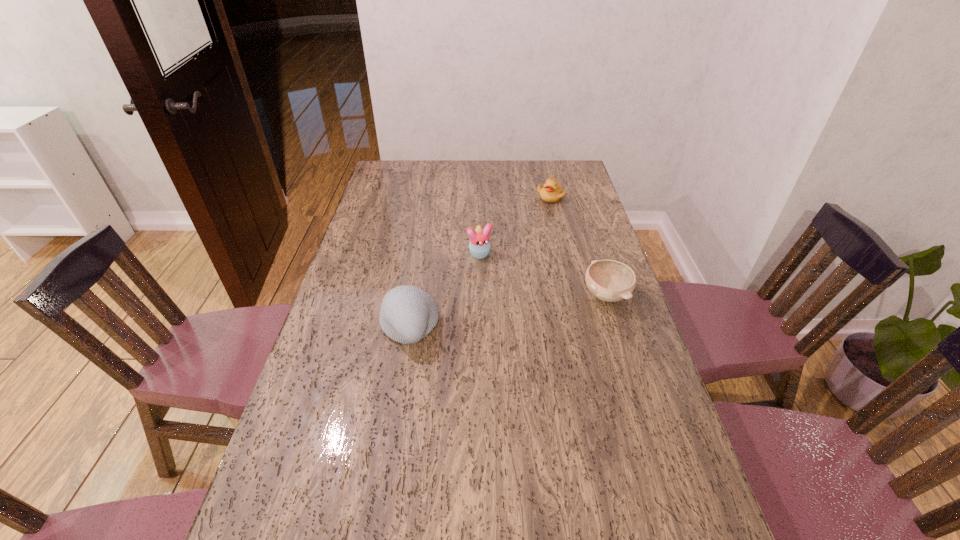
The height and width of the screenshot is (540, 960). I want to click on vacant area that lies between the bowl and the duckling, so click(x=578, y=246).

The height and width of the screenshot is (540, 960). Identify the location of object that stands as the second closest to the bowl. (408, 314).

This screenshot has width=960, height=540. I want to click on object that is the closest to the leftmost object, so click(x=479, y=245).

In order to click on free spot that satisfies the following two spatial constraints: 1. on the back side of the farthest object; 2. on the right side of the leftmost object in this screenshot , I will do `click(430, 197)`.

At what (x,y) coordinates should I click in order to perform the action: click on vacant space that satisfies the following two spatial constraints: 1. on the back side of the leftmost object; 2. on the left side of the third nearest object. Please return your answer as a coordinate pair (x, y). Image resolution: width=960 pixels, height=540 pixels. Looking at the image, I should click on (420, 254).